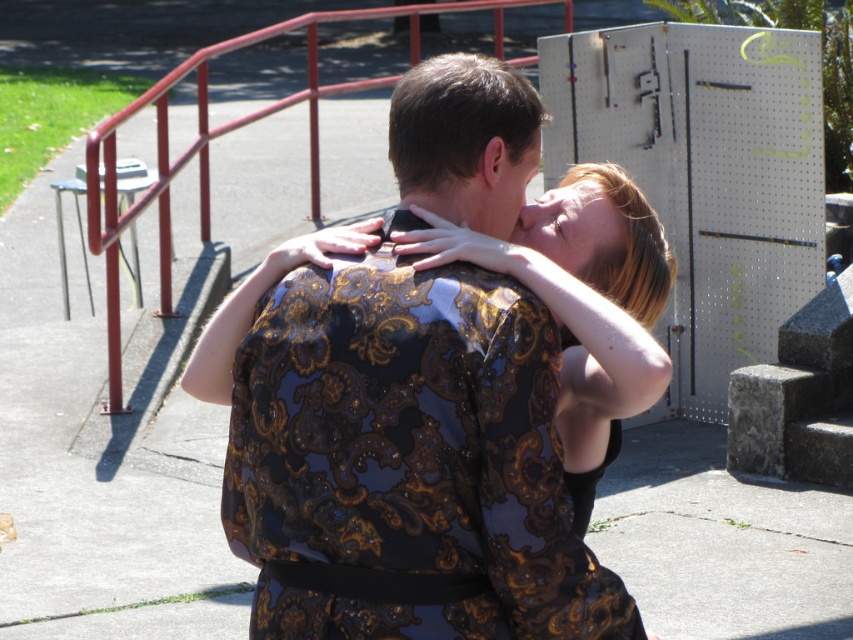
You are standing at the origin point of the coordinate system in the image. The glossy floral patterned dress at center is located at point (x=407, y=461). If you want to walk directly to the glossy floral patterned dress at center, which direction should you move in?

The glossy floral patterned dress at center is located at point (x=407, y=461). Since the coordinate system is normalized, moving towards the positive x and y directions from the origin would lead you to the dress.